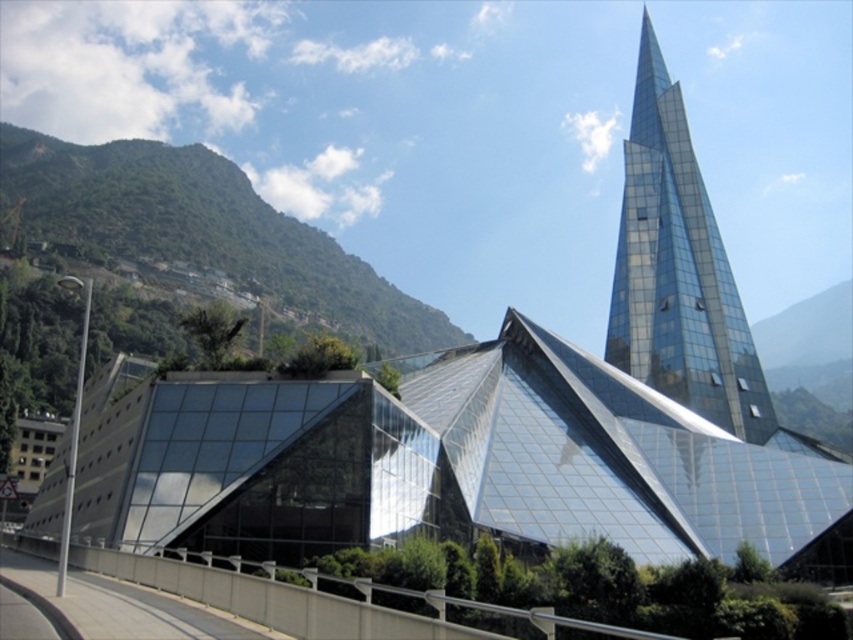
Is transparent glass building at center positioned behind transparent glass spire at upper right?

No, transparent glass building at center is closer to the viewer.

Can you confirm if transparent glass building at center is smaller than transparent glass spire at upper right?

Yes, transparent glass building at center is smaller than transparent glass spire at upper right.

You are a GUI agent. You are given a task and a screenshot of the screen. Output one action in this format:
    pyautogui.click(x=<x>, y=<y>)
    Task: Click on the transparent glass building at center
    The image size is (853, 640).
    Given the screenshot: What is the action you would take?
    pyautogui.click(x=445, y=461)

The image size is (853, 640). Find the location of `transparent glass building at center`. transparent glass building at center is located at coordinates (445, 461).